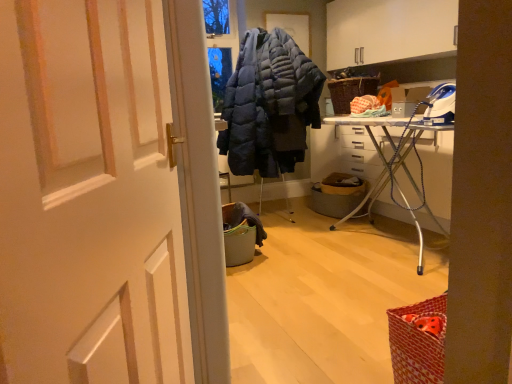
Find the location of a particular element. The image size is (512, 384). vacant space underneath dark blue quilted jacket at center (from a real-world perspective) is located at coordinates [281, 216].